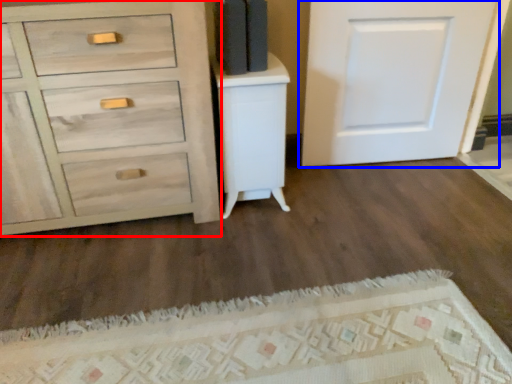
Question: Which point is closer to the camera, chest of drawers (highlighted by a red box) or door (highlighted by a blue box)?

Choices:
 (A) chest of drawers
 (B) door

Answer: (A)